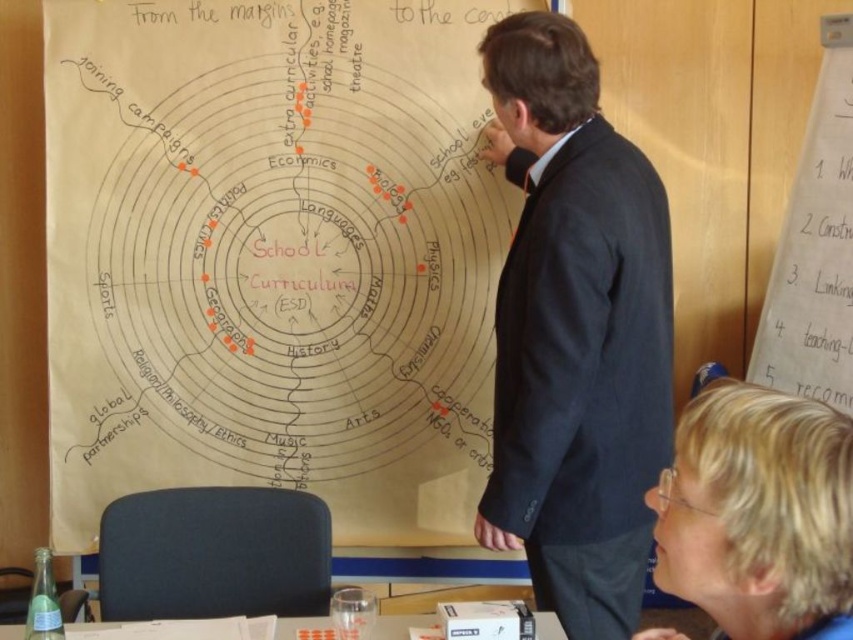
Question: Is hand-drawn paperboard at center positioned before white paper at upper right?

Choices:
 (A) yes
 (B) no

Answer: (B)

Question: Does dark blue suit at center have a smaller size compared to white paper at upper right?

Choices:
 (A) no
 (B) yes

Answer: (A)

Question: Which of the following is the closest to the observer?

Choices:
 (A) dark blue suit at center
 (B) hand-drawn paperboard at center
 (C) white paper at lower center

Answer: (C)

Question: Which point is farther to the camera?

Choices:
 (A) (415, 620)
 (B) (442, 252)
 (C) (489, 77)

Answer: (B)

Question: Can you confirm if dark blue suit at center is positioned above white paper at lower center?

Choices:
 (A) yes
 (B) no

Answer: (A)

Question: Among these objects, which one is farthest from the camera?

Choices:
 (A) dark blue suit at center
 (B) hand-drawn paperboard at center

Answer: (B)